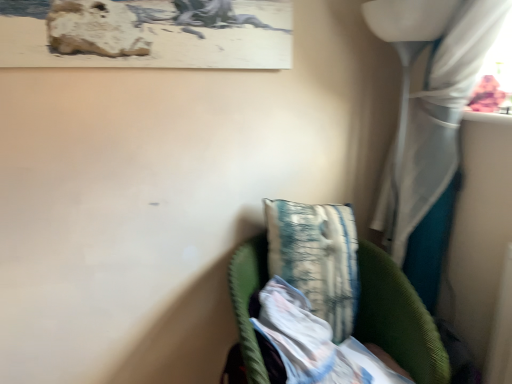
Question: Is white sheer curtain at right oriented towards white textured fabric at lower center?

Choices:
 (A) yes
 (B) no

Answer: (A)

Question: From a real-world perspective, is white sheer curtain at right under white textured fabric at lower center?

Choices:
 (A) no
 (B) yes

Answer: (A)

Question: Would you say white sheer curtain at right is a long distance from white textured fabric at lower center?

Choices:
 (A) no
 (B) yes

Answer: (A)

Question: Is white sheer curtain at right located outside white textured fabric at lower center?

Choices:
 (A) yes
 (B) no

Answer: (A)

Question: Is white sheer curtain at right touching white textured fabric at lower center?

Choices:
 (A) yes
 (B) no

Answer: (B)

Question: Does white sheer curtain at right appear on the right side of white textured fabric at lower center?

Choices:
 (A) no
 (B) yes

Answer: (B)

Question: Is green corduroy chair at lower right in contact with white textured fabric at lower center?

Choices:
 (A) no
 (B) yes

Answer: (B)

Question: Would you consider green corduroy chair at lower right to be distant from white textured fabric at lower center?

Choices:
 (A) no
 (B) yes

Answer: (A)

Question: From a real-world perspective, does green corduroy chair at lower right stand above white textured fabric at lower center?

Choices:
 (A) yes
 (B) no

Answer: (B)

Question: Is green corduroy chair at lower right thinner than white textured fabric at lower center?

Choices:
 (A) yes
 (B) no

Answer: (B)

Question: Does green corduroy chair at lower right have a lesser height compared to white textured fabric at lower center?

Choices:
 (A) yes
 (B) no

Answer: (B)

Question: Is green corduroy chair at lower right not inside white textured fabric at lower center?

Choices:
 (A) yes
 (B) no

Answer: (A)

Question: Considering the relative sizes of textured fabric pillow at center and green corduroy chair at lower right in the image provided, is textured fabric pillow at center smaller than green corduroy chair at lower right?

Choices:
 (A) yes
 (B) no

Answer: (A)